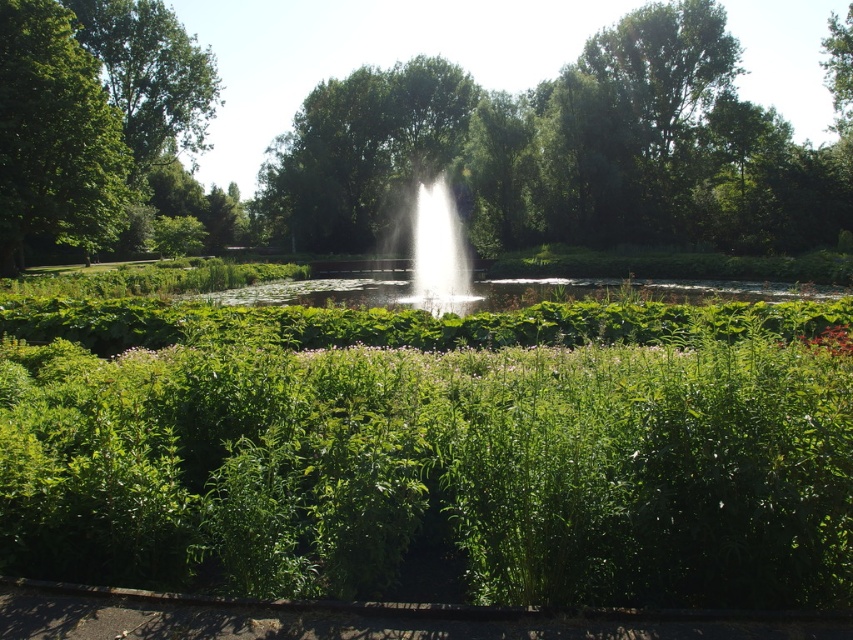
You are standing in the park and want to take a photo of the white water at center without the green leafy tree at left blocking the view. Is there a way to position yourself so that the tree is not in the frame?

The green leafy tree at left is positioned over the white water at center, so it would be difficult to capture the white water at center without the tree blocking the view unless you move to a position where the tree is out of the camera frame, such as behind it or to the side where its branches do not obstruct the water.

Looking at this image, you are standing in the park and want to take a photo of both the fountain and the pink flowers. The fountain is located at point (x=461, y=241) and the pink flowers are at point (x=61, y=76). Which point should you stand closer to ensure both are in focus?

You should stand closer to point (x=61, y=76) where the pink flowers are located because it is closer to the camera than point (x=461, y=241) where the fountain is located. This allows both subjects to be within the depth of field for better focus.